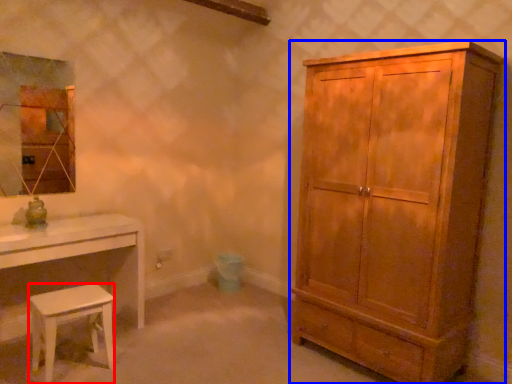
Question: Which of the following is the closest to the observer, stool (highlighted by a red box) or cabinetry (highlighted by a blue box)?

Choices:
 (A) stool
 (B) cabinetry

Answer: (B)